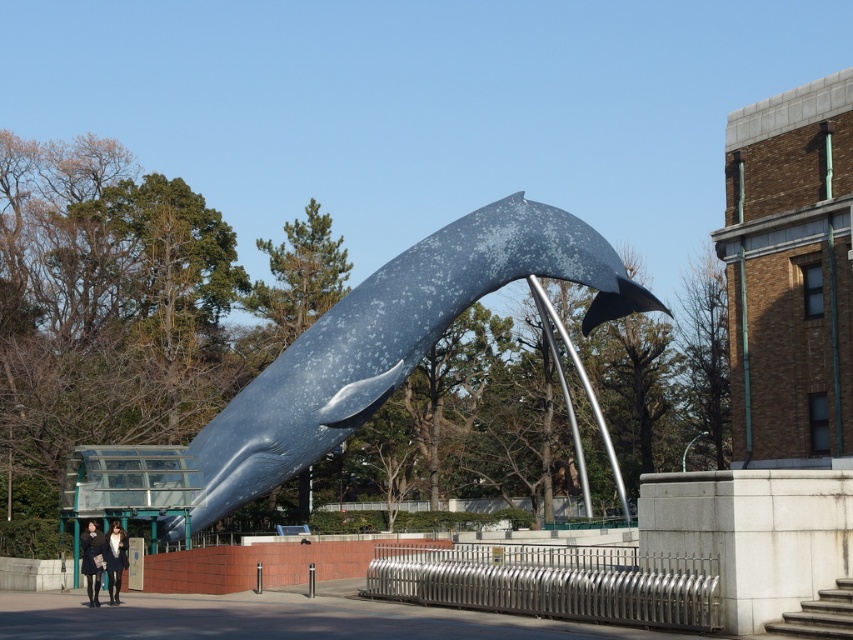
Question: Which point appears closest to the camera in this image?

Choices:
 (A) click(x=108, y=557)
 (B) click(x=264, y=454)

Answer: (A)

Question: Among these objects, which one is farthest from the camera?

Choices:
 (A) black wool coat at lower left
 (B) matte black coat at lower left

Answer: (B)

Question: Is speckled blue whale at center behind black wool coat at lower left?

Choices:
 (A) no
 (B) yes

Answer: (B)

Question: Can you confirm if speckled blue whale at center is positioned below black wool coat at lower left?

Choices:
 (A) no
 (B) yes

Answer: (A)

Question: Is black wool coat at lower left thinner than matte black coat at lower left?

Choices:
 (A) yes
 (B) no

Answer: (B)

Question: Which object is closer to the camera taking this photo?

Choices:
 (A) speckled blue whale at center
 (B) black wool coat at lower left
 (C) matte black coat at lower left

Answer: (B)